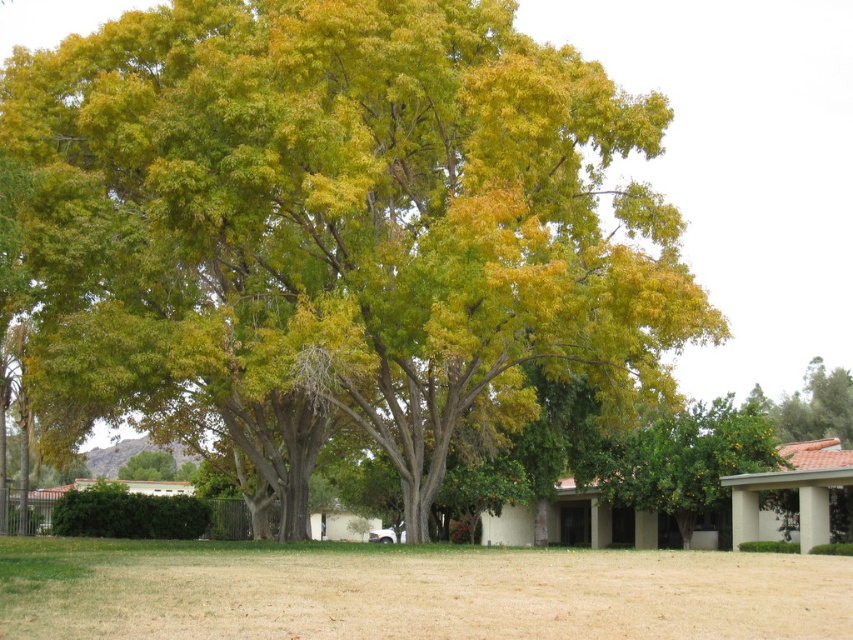
You are a gardener planning to plant a new flower bed between the green leafy tree at center and the brown dry grass at lower center. Based on their positions, where should you place the flower bed so it is between both objects?

The flower bed should be placed between the green leafy tree at center and the brown dry grass at lower center since the tree is on the left side of the grass, so the flower bed should be positioned to the right of the tree and to the left of the grass.

Based on the scene description, where is the green leafy tree at center located in terms of coordinates?

The green leafy tree at center is located at coordinates point (x=338, y=227).